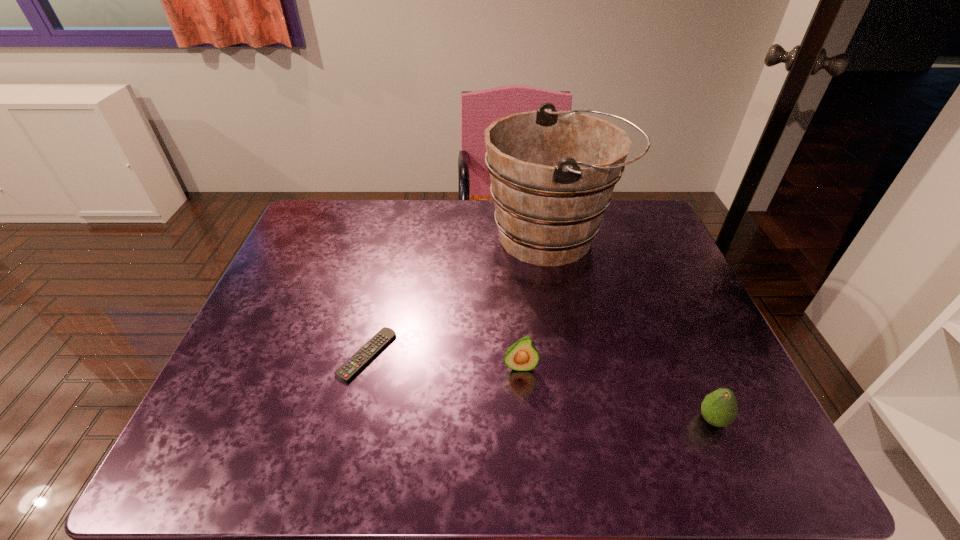
Locate an element on the screen. The width and height of the screenshot is (960, 540). bucket is located at coordinates (553, 172).

Identify the location of the farthest object. (553, 172).

Locate an element on the screen. This screenshot has width=960, height=540. the farther avocado is located at coordinates (522, 356).

I want to click on the nearer avocado, so click(x=719, y=408).

This screenshot has height=540, width=960. I want to click on the third tallest object, so click(x=719, y=408).

Where is `the shortest object`? The image size is (960, 540). the shortest object is located at coordinates (379, 341).

Find the location of a particular element. This screenshot has height=540, width=960. the leftmost object is located at coordinates pos(379,341).

The height and width of the screenshot is (540, 960). What are the coordinates of `free region located 0.050m on the handle side of the tallest object` in the screenshot? It's located at (637, 238).

Where is `vacant area situated 0.060m on the cut side of the farther avocado`? This screenshot has height=540, width=960. vacant area situated 0.060m on the cut side of the farther avocado is located at coordinates (522, 399).

Locate an element on the screen. The width and height of the screenshot is (960, 540). free space located on the left of the nearer avocado is located at coordinates (637, 420).